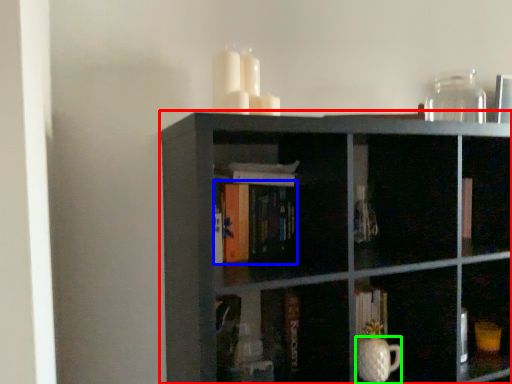
Question: Which object is positioned farthest from shelf (highlighted by a red box)? Select from book (highlighted by a blue box) and glass vase (highlighted by a green box).

Choices:
 (A) book
 (B) glass vase

Answer: (B)